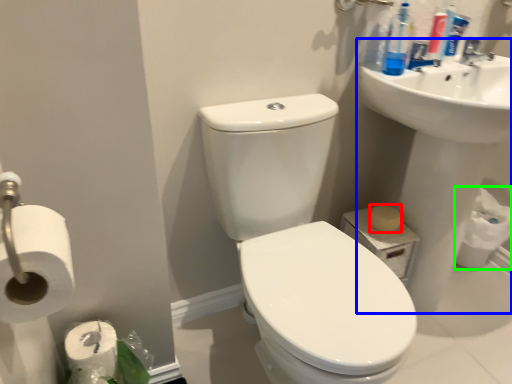
Question: Based on their relative distances, which object is nearer to soap (highlighted by a red box)? Choose from sink (highlighted by a blue box) and toilet paper (highlighted by a green box).

Choices:
 (A) sink
 (B) toilet paper

Answer: (A)